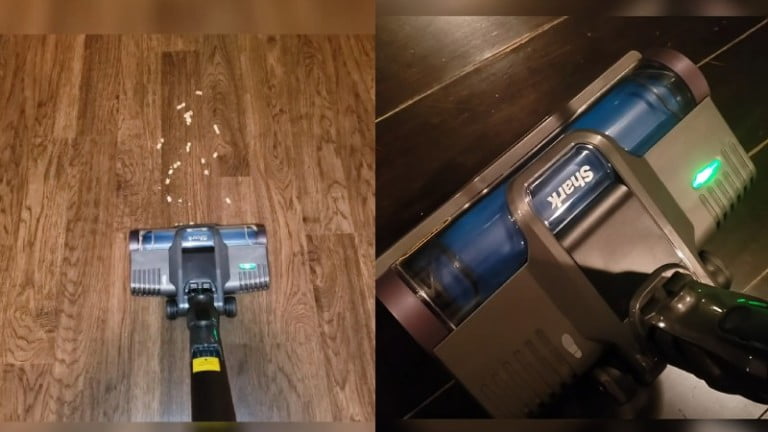
Where is `dark wood floor`? This screenshot has width=768, height=432. dark wood floor is located at coordinates (459, 170).